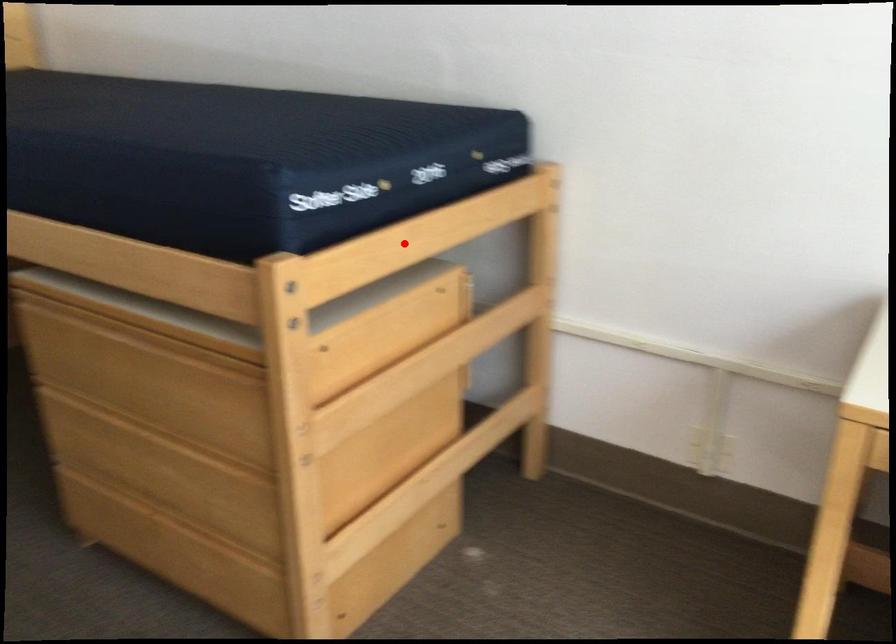
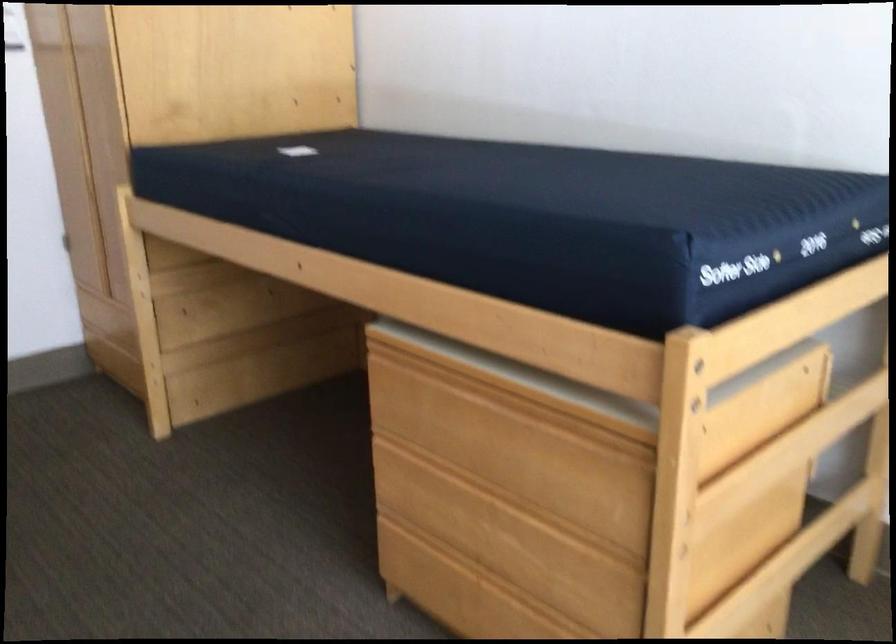
Locate, in the second image, the point that corresponds to the highlighted location in the first image.

(789, 319)